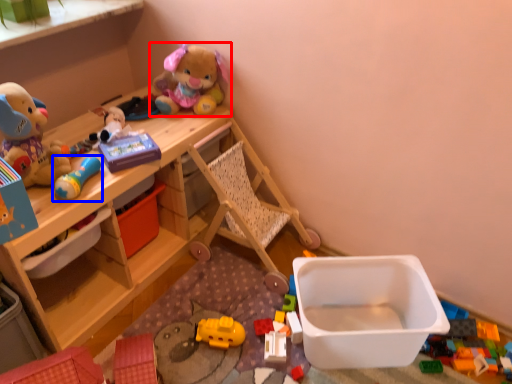
Question: Among these objects, which one is nearest to the camera, toy (highlighted by a red box) or toy (highlighted by a blue box)?

Choices:
 (A) toy
 (B) toy

Answer: (B)